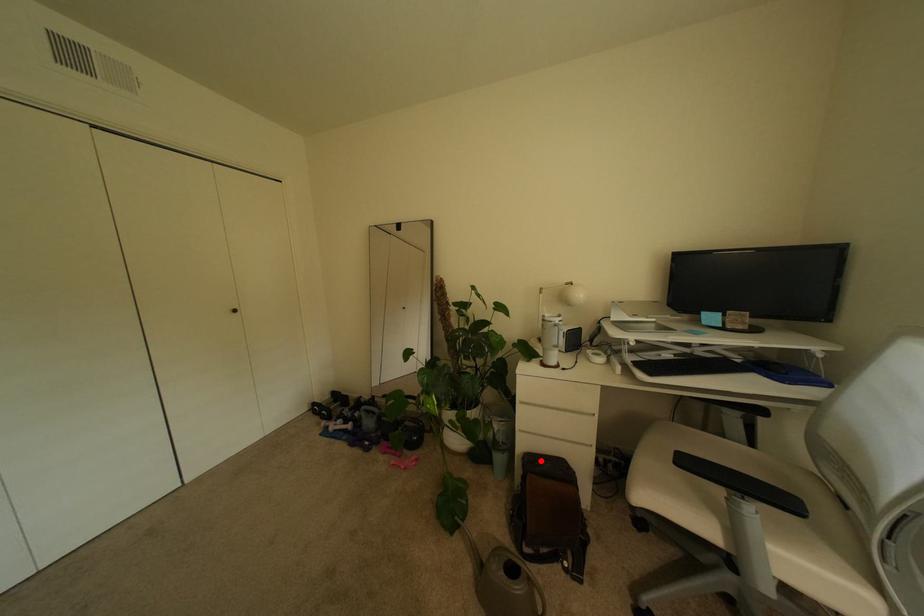
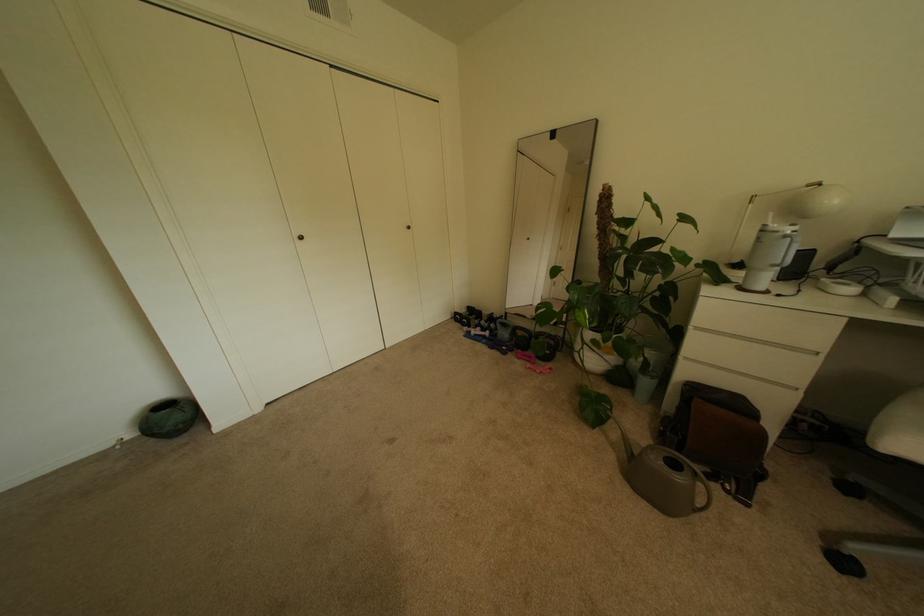
Question: A red point is marked in image1. In image2, is the corresponding 3D point closer to the camera or farther? Reply with the corresponding letter.

Choices:
 (A) The corresponding 3D point is closer.
 (B) The corresponding 3D point is farther.

Answer: (A)